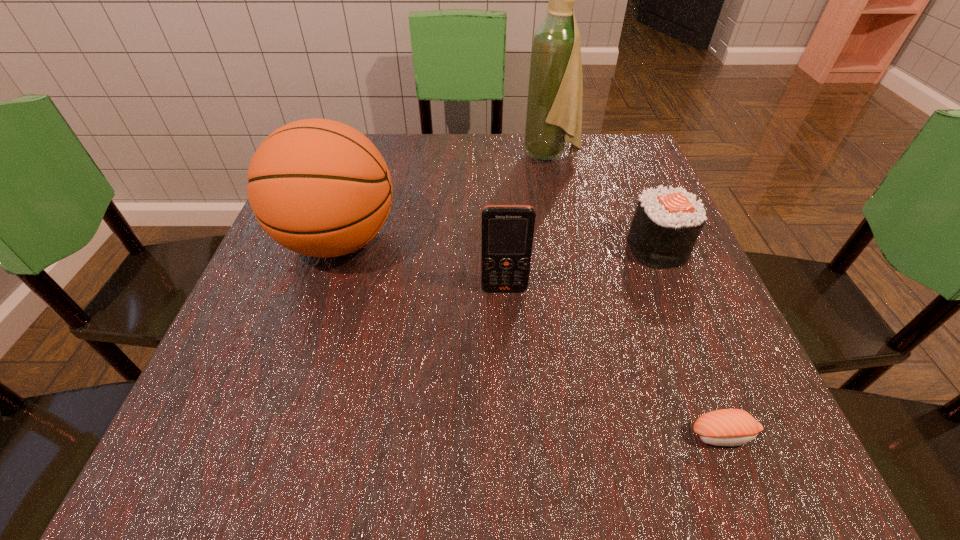
Locate an element on the screen. The height and width of the screenshot is (540, 960). the tallest object is located at coordinates (555, 91).

You are a GUI agent. You are given a task and a screenshot of the screen. Output one action in this format:
    pyautogui.click(x=<x>, y=<y>)
    Task: Click on the wine bottle
    
    Given the screenshot: What is the action you would take?
    pyautogui.click(x=555, y=91)

Locate an element on the screen. Image resolution: width=960 pixels, height=540 pixels. the leftmost object is located at coordinates (318, 187).

You are a GUI agent. You are given a task and a screenshot of the screen. Output one action in this format:
    pyautogui.click(x=<x>, y=<y>)
    Task: Click on the basketball
    This screenshot has width=960, height=540.
    Given the screenshot: What is the action you would take?
    pyautogui.click(x=318, y=187)

Locate an element on the screen. the third tallest object is located at coordinates (507, 231).

At what (x,y) coordinates should I click in order to perform the action: click on the fourth object from right to left. Please return your answer as a coordinate pair (x, y). This screenshot has height=540, width=960. Looking at the image, I should click on (507, 231).

This screenshot has height=540, width=960. Find the location of `the farther sushi`. the farther sushi is located at coordinates (666, 224).

Where is `the taller sushi`? the taller sushi is located at coordinates (666, 224).

Locate an element on the screen. This screenshot has width=960, height=540. the shortest object is located at coordinates [726, 427].

Where is `the nearer sushi`? the nearer sushi is located at coordinates (726, 427).